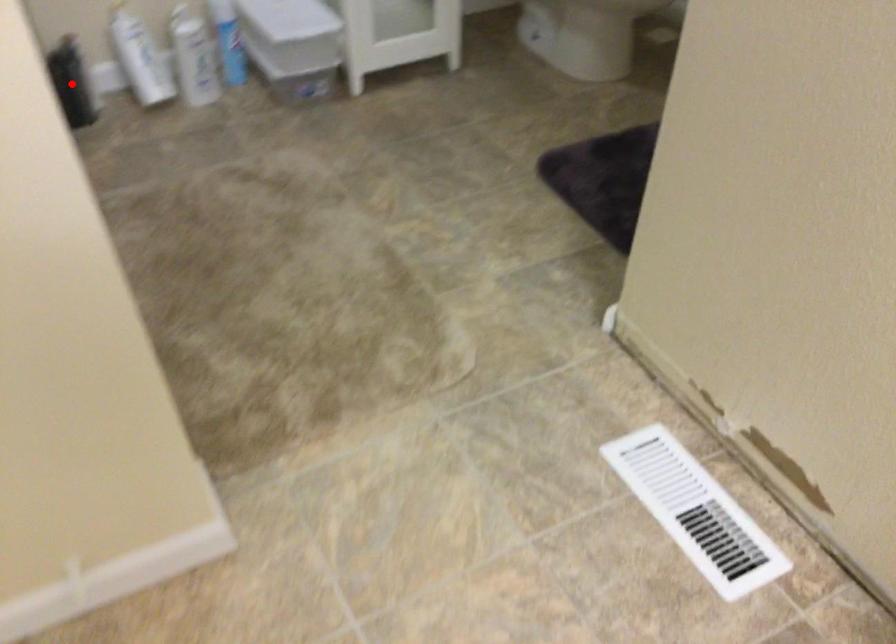
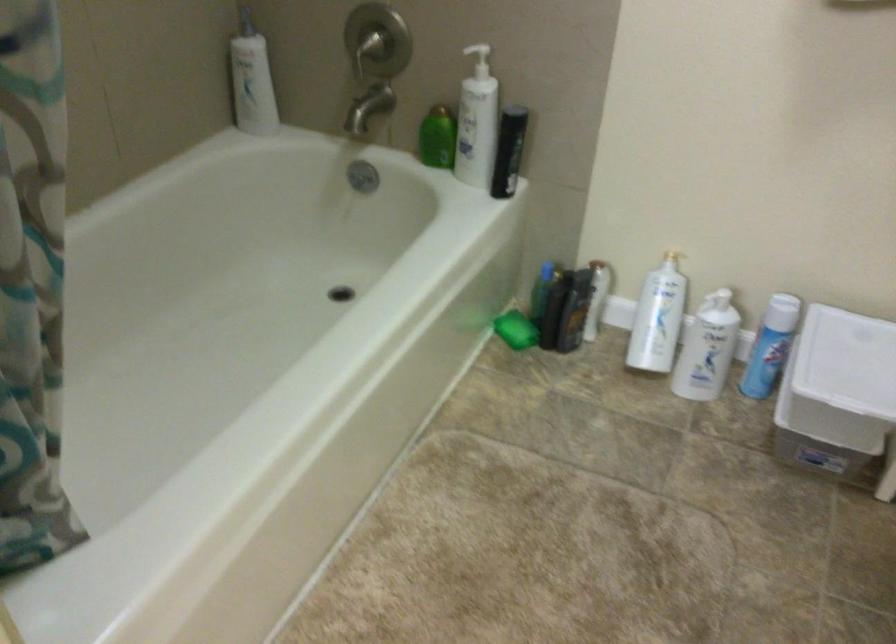
In the second image, find the point that corresponds to the highlighted location in the first image.

(554, 308)